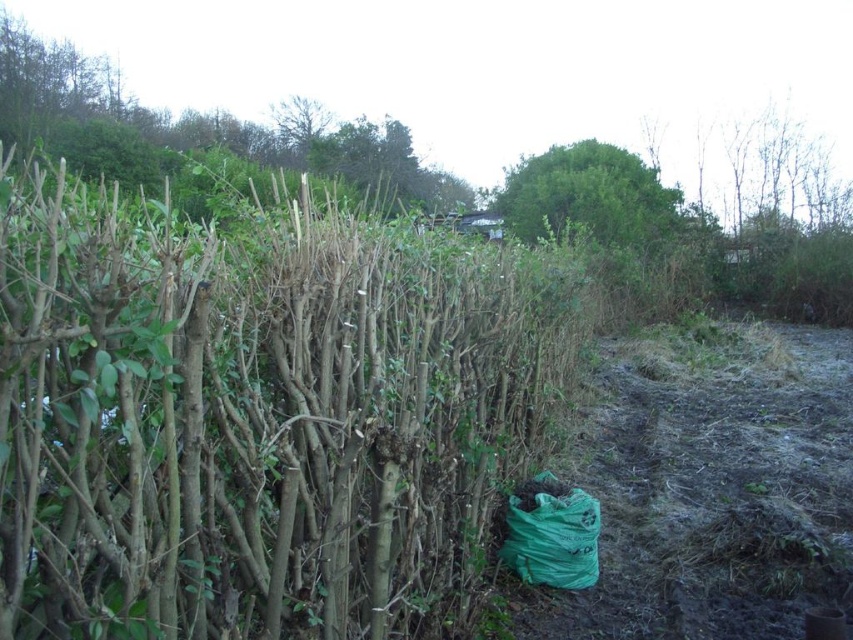
You are a gardener who needs to carry some pruned branches. You see a green fabric bag at lower center and a green leafy tree at upper left. Which item is smaller in size?

The green fabric bag at lower center has a smaller size compared to the green leafy tree at upper left, so the green fabric bag at lower center is smaller.

Based on the photo, you are standing at the point marked by the coordinates point (258, 413) in the image. Looking around, you see a dense hedge with green leaves and a dirt path bordered by dry grass. What object is located at your current position?

The point (258, 413) corresponds to the green fabric bag at lower center.

You are a gardener who needs to carry some pruned branches. You have a green fabric bag at lower center and a green leafy tree at upper left. Which object can you use to carry the branches?

The green fabric bag at lower center can be used to carry the branches since it is a bag designed for carrying items, unlike the green leafy tree at upper left which is a tree and cannot be used for carrying.